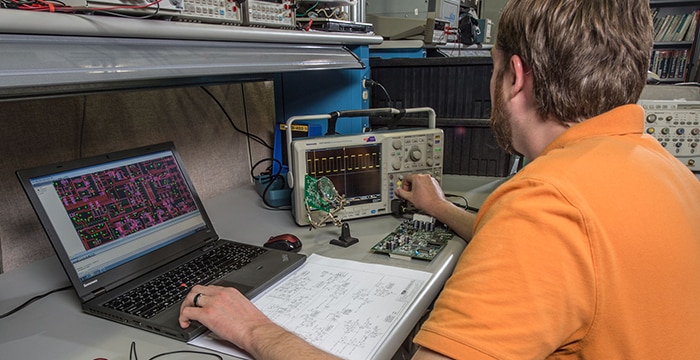
At what (x,y) coordinates should I click in order to perform the action: click on display screen. Please return your answer as a coordinate pair (x, y). Looking at the image, I should click on (344, 166), (126, 208).